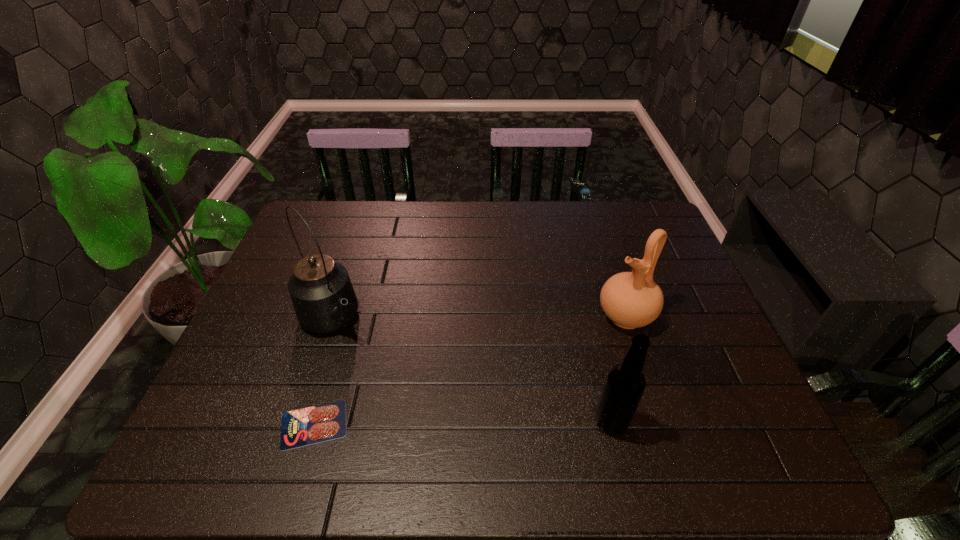
At what (x,y) coordinates should I click in order to perform the action: click on vacant space at the far right corner of the desktop. Please return your answer as a coordinate pair (x, y). The height and width of the screenshot is (540, 960). Looking at the image, I should click on (637, 236).

Locate an element on the screen. blank region between the beer bottle and the shortest object is located at coordinates (463, 423).

Locate an element on the screen. Image resolution: width=960 pixels, height=540 pixels. free point between the pottery and the kettle is located at coordinates (479, 318).

The height and width of the screenshot is (540, 960). Identify the location of free point between the beer bottle and the tallest object. (471, 370).

In order to click on blank region between the beer bottle and the tallest object in this screenshot , I will do `click(471, 370)`.

Where is `unoccupied position between the pottery and the shortest object`? unoccupied position between the pottery and the shortest object is located at coordinates (469, 370).

Image resolution: width=960 pixels, height=540 pixels. Identify the location of unoccupied area between the salami and the tallest object. (324, 372).

Find the location of a particular element. vacant region between the beer bottle and the shortest object is located at coordinates (463, 423).

Locate an element on the screen. Image resolution: width=960 pixels, height=540 pixels. object that stands as the closest to the shortest object is located at coordinates point(324,300).

I want to click on the closest object to the pottery, so click(x=625, y=383).